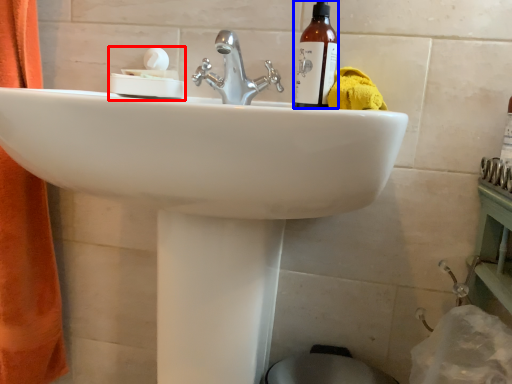
Question: Which object appears farthest to the camera in this image, tissue (highlighted by a red box) or bottle (highlighted by a blue box)?

Choices:
 (A) tissue
 (B) bottle

Answer: (A)